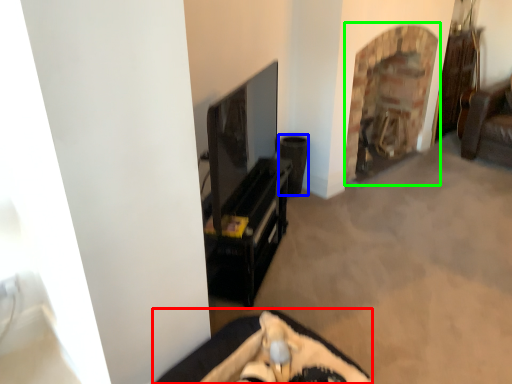
Question: Estimate the real-world distances between objects in this image. Which object is closer to furniture (highlighted by a red box), speaker (highlighted by a blue box) or fireplace (highlighted by a green box)?

Choices:
 (A) speaker
 (B) fireplace

Answer: (A)